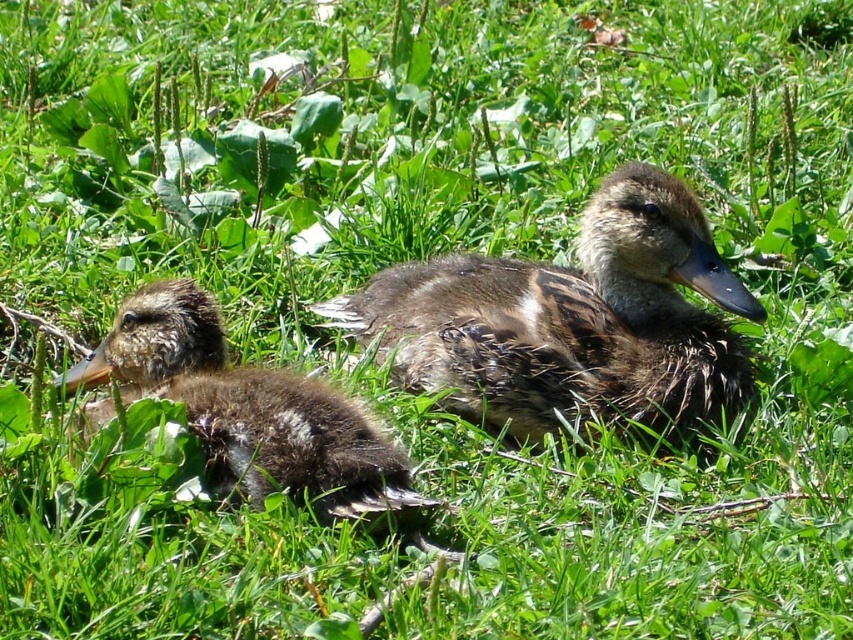
Is brown fuzzy duckling at center thinner than brown fuzzy duckling at left?

No.

The height and width of the screenshot is (640, 853). I want to click on brown fuzzy duckling at center, so click(x=572, y=321).